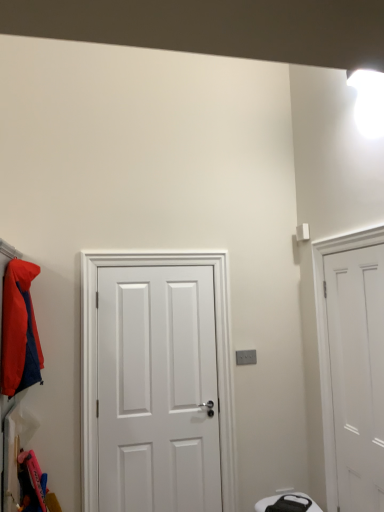
Question: From the image's perspective, relative to white matte door at right, placed as the 2th door when sorted from left to right, is white matte door at center, acting as the 2th door starting from the right, above or below?

Choices:
 (A) below
 (B) above

Answer: (A)

Question: Would you say white matte door at center, which ranks as the 1th door in left-to-right order, is inside or outside white matte door at right, placed as the 2th door when sorted from left to right?

Choices:
 (A) inside
 (B) outside

Answer: (B)

Question: Estimate the real-world distances between objects in this image. Which object is closer to the white matte door at center, acting as the 2th door starting from the right?

Choices:
 (A) white matte door at right, placed as the 2th door when sorted from left to right
 (B) matte orange jacket at left

Answer: (B)

Question: Which object is positioned closest to the white matte door at center, acting as the 2th door starting from the right?

Choices:
 (A) white matte door at right, placed as the 2th door when sorted from left to right
 (B) matte orange jacket at left

Answer: (B)